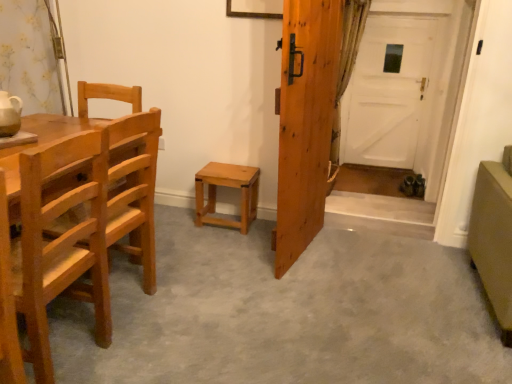
At what (x,y) coordinates should I click in order to perform the action: click on vacant space in between wooden door at center, which is counted as the 1th door, starting from the left, and light brown wood chair at left, the 1th chair in the front-to-back sequence. Please return your answer as a coordinate pair (x, y). Looking at the image, I should click on (211, 287).